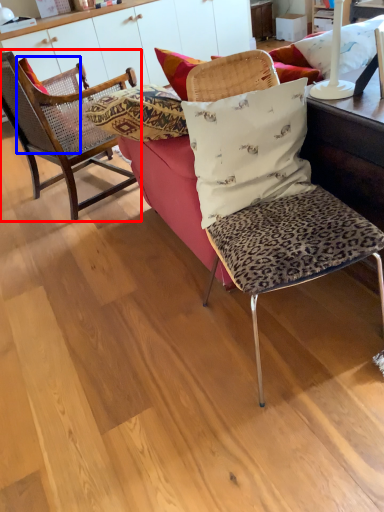
Question: Which object appears closest to the camera in this image, chair (highlighted by a red box) or pillow (highlighted by a blue box)?

Choices:
 (A) chair
 (B) pillow

Answer: (A)